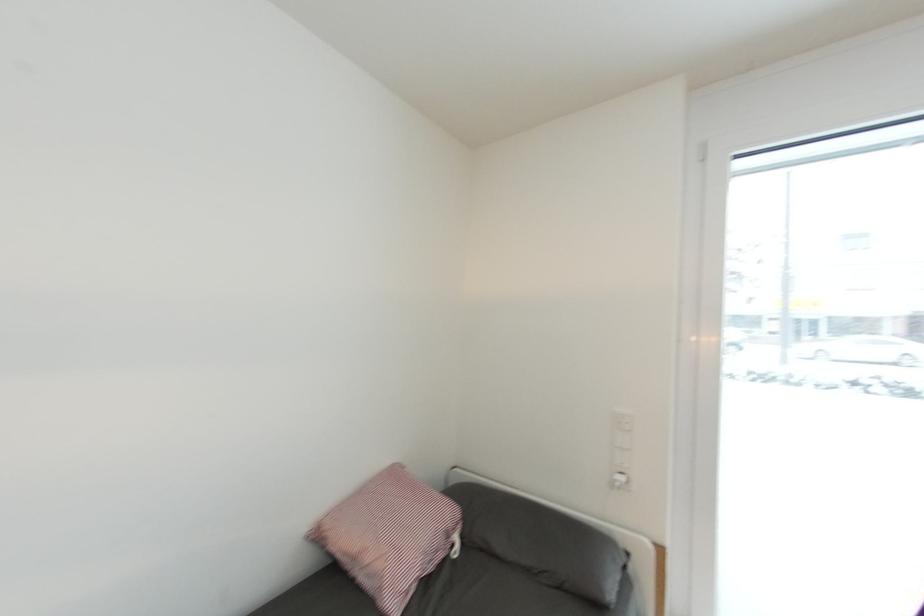
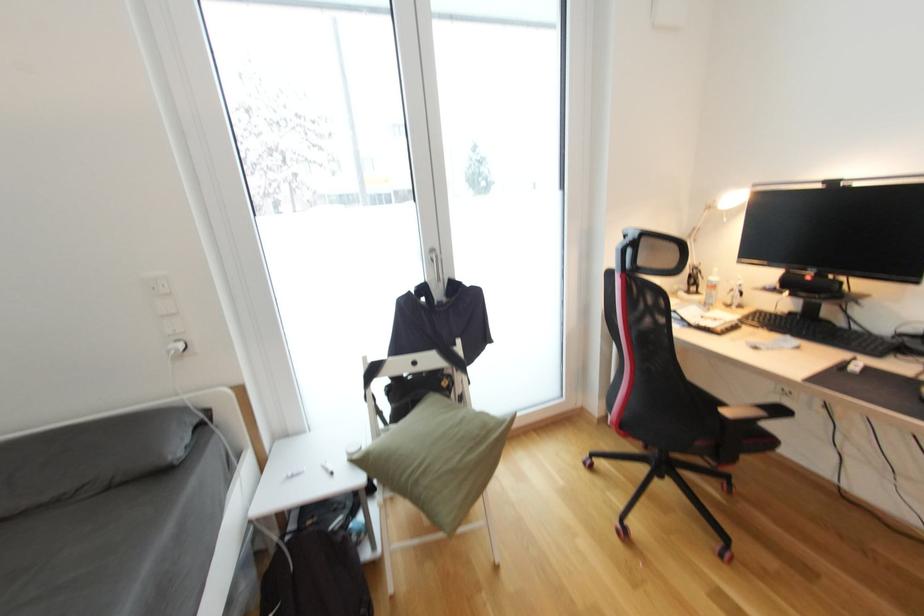
How did the camera likely rotate?

The camera rotated toward right-down.